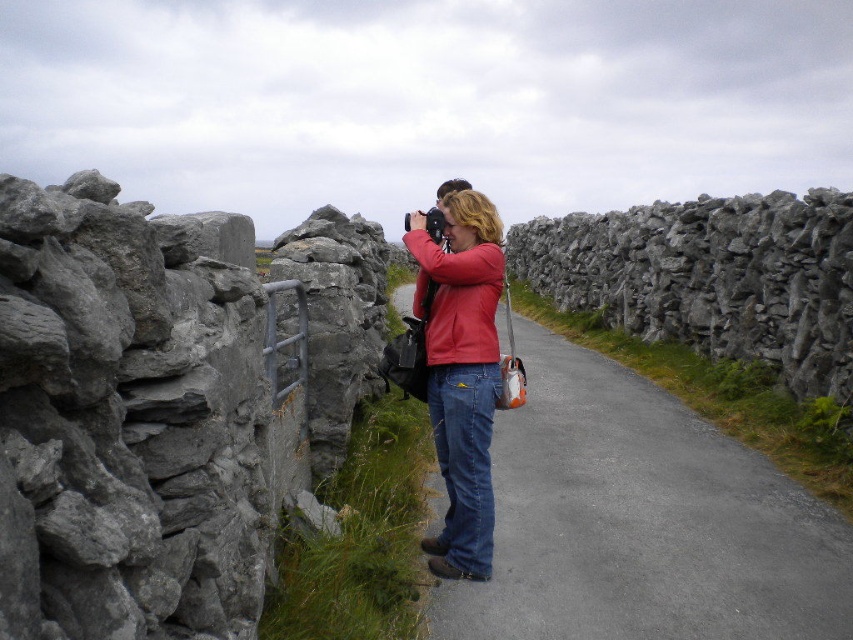
You are standing at the entrance of the metal gate within the stone wall on the left side of the gray asphalt road at center. Which direction should you walk to reach the road?

The gray asphalt road at center is located at point (641, 522), so you should walk towards the center of the image to reach the road.

You are standing on the gray asphalt road at center and want to reach the gray rough stone at left. Which direction should you move to get there?

The gray rough stone at left is located above the gray asphalt road at center, so you should move upward to reach it.